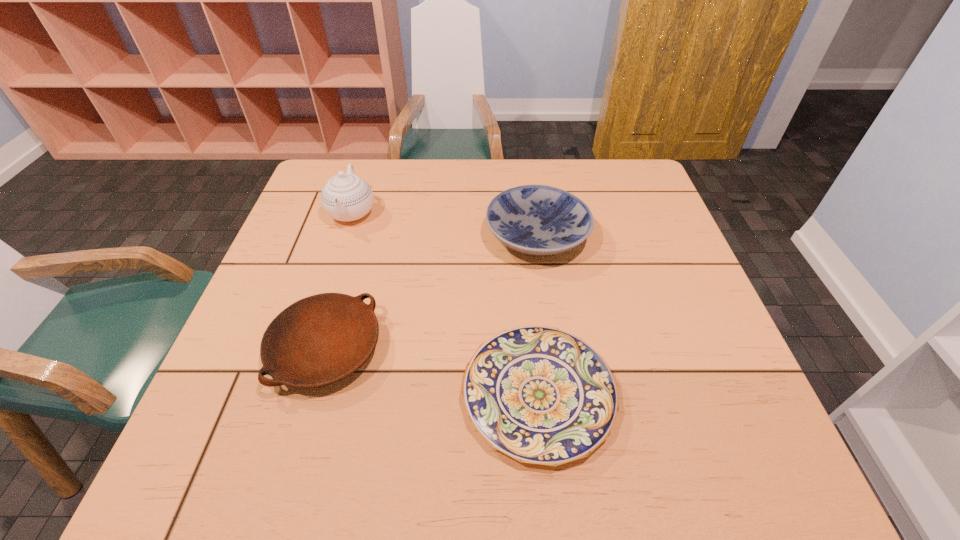
Locate an element on the screen. object that is the third nearest to the chinaware is located at coordinates (538, 394).

This screenshot has height=540, width=960. I want to click on object that stands as the second closest to the chinaware, so click(539, 220).

The height and width of the screenshot is (540, 960). I want to click on the second closest plate to the tallest object, so click(x=539, y=220).

Identify which plate is the third closest to the tallest object. Please provide its 2D coordinates. Your answer should be formatted as a tuple, i.e. [(x, y)], where the tuple contains the x and y coordinates of a point satisfying the conditions above.

[(538, 394)]

Locate an element on the screen. vacant area in the image that satisfies the following two spatial constraints: 1. on the spout of the tallest object; 2. on the left side of the leftmost plate is located at coordinates (307, 349).

This screenshot has height=540, width=960. What are the coordinates of `vacant region that satisfies the following two spatial constraints: 1. on the spout of the shortest object; 2. on the right side of the tallest object` in the screenshot? It's located at (292, 395).